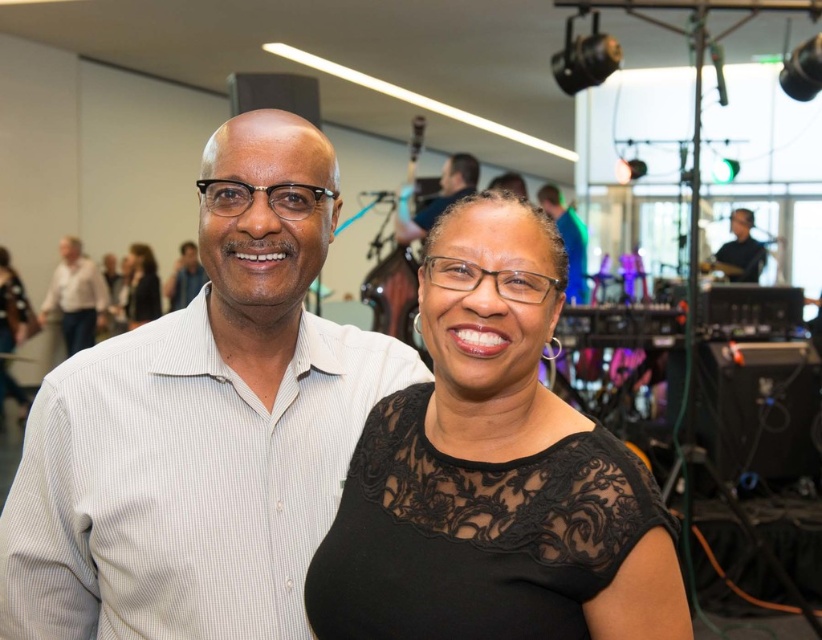
Question: Which point is farther to the camera?

Choices:
 (A) matte black dress at upper center
 (B) matte white shirt at upper left
 (C) white shirt at left

Answer: (A)

Question: Considering the real-world distances, which object is farthest from the white shirt at left?

Choices:
 (A) matte white shirt at upper left
 (B) matte black dress at upper center
 (C) blue fabric at upper center
 (D) matte black shirt at upper right

Answer: (D)

Question: Which of the following is the farthest from the observer?

Choices:
 (A) (141, 266)
 (B) (760, 257)
 (C) (185, 257)
 (D) (455, 184)

Answer: (C)

Question: Is blue fabric at upper center wider than matte black dress at upper center?

Choices:
 (A) yes
 (B) no

Answer: (A)

Question: Can you confirm if black lace dress at center is wider than white shirt at left?

Choices:
 (A) yes
 (B) no

Answer: (A)

Question: Does blue fabric at upper center lie in front of matte white shirt at upper left?

Choices:
 (A) yes
 (B) no

Answer: (A)